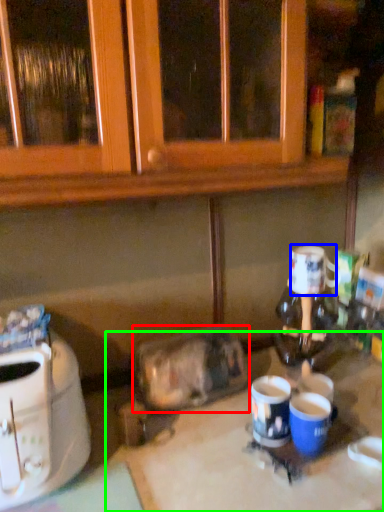
Question: Considering the real-world distances, which object is closest to appliance (highlighted by a red box)? coffee cup (highlighted by a blue box) or table (highlighted by a green box).

Choices:
 (A) coffee cup
 (B) table

Answer: (B)